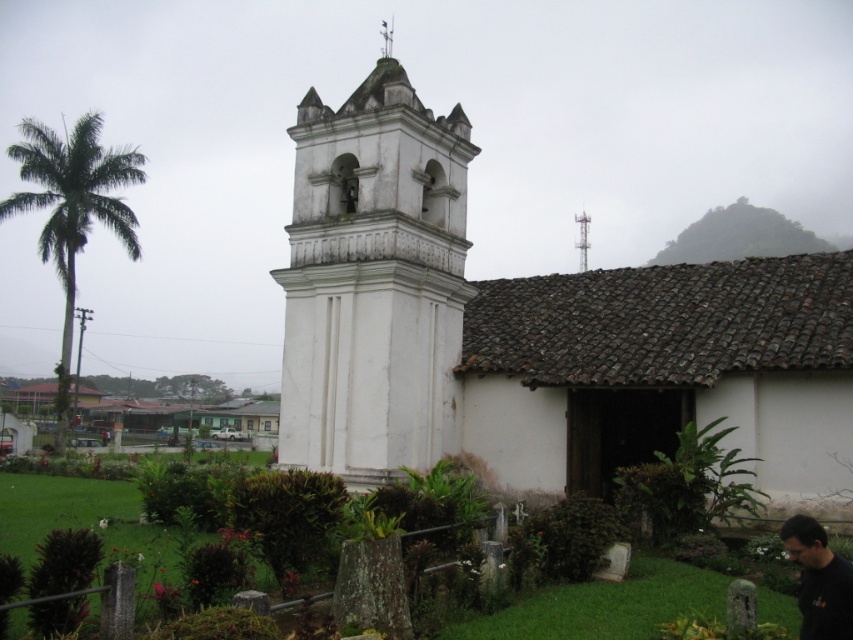
Does white stone bell tower at center lie behind black matte shirt at lower right?

Yes, white stone bell tower at center is behind black matte shirt at lower right.

Is point (361, 406) in front of point (825, 568)?

No, it is behind (825, 568).

Identify the location of white stone bell tower at center. (374, 282).

Between white stone bell tower at center and green leafy palm at left, which one is positioned lower?

white stone bell tower at center is below.

What are the coordinates of `white stone bell tower at center` in the screenshot? It's located at (374, 282).

Who is more forward, (434, 435) or (50, 148)?

Point (434, 435) is in front.

Where is `white stone bell tower at center`? This screenshot has width=853, height=640. white stone bell tower at center is located at coordinates (374, 282).

What do you see at coordinates (531, 332) in the screenshot? The height and width of the screenshot is (640, 853). I see `white stucco church at center` at bounding box center [531, 332].

Is white stucco church at center shorter than green leafy palm at left?

Correct, white stucco church at center is not as tall as green leafy palm at left.

Where is `white stucco church at center`? white stucco church at center is located at coordinates (531, 332).